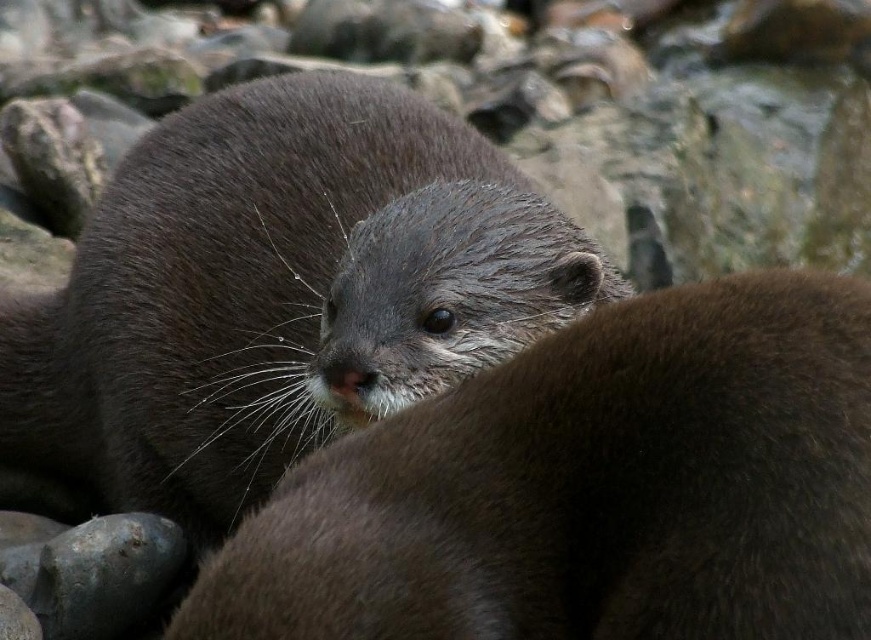
Based on the photo, who is higher up, soft brown fur otter at center or dark brown fur otter at center?

dark brown fur otter at center is higher up.

Does soft brown fur otter at center have a lesser width compared to dark brown fur otter at center?

Yes, soft brown fur otter at center is thinner than dark brown fur otter at center.

Between point (812, 596) and point (309, 243), which one is positioned behind?

Positioned behind is point (309, 243).

Locate an element on the screen. This screenshot has width=871, height=640. soft brown fur otter at center is located at coordinates (591, 488).